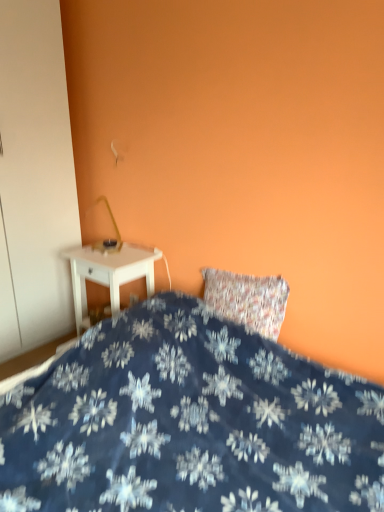
This screenshot has height=512, width=384. What do you see at coordinates (35, 178) in the screenshot?
I see `white matte armoire at left` at bounding box center [35, 178].

This screenshot has width=384, height=512. What do you see at coordinates (189, 423) in the screenshot?
I see `blue fabric bed at lower center` at bounding box center [189, 423].

This screenshot has height=512, width=384. I want to click on white matte armoire at left, so click(35, 178).

Considering the relative sizes of blue fabric bed at lower center and white plastic electric outlet at lower center in the image provided, is blue fabric bed at lower center shorter than white plastic electric outlet at lower center?

No.

From the picture: Is blue fabric bed at lower center not within white plastic electric outlet at lower center?

blue fabric bed at lower center lies outside white plastic electric outlet at lower center's area.

From the picture: Is there a large distance between blue fabric bed at lower center and white plastic electric outlet at lower center?

Yes, blue fabric bed at lower center and white plastic electric outlet at lower center are located far from each other.

How many degrees apart are the facing directions of blue fabric bed at lower center and white plastic electric outlet at lower center?

0.528 degrees.

Is white plastic electric outlet at lower center next to blue fabric bed at lower center?

No, white plastic electric outlet at lower center is not making contact with blue fabric bed at lower center.

Based on the photo, from the image's perspective, is white plastic electric outlet at lower center positioned above or below blue fabric bed at lower center?

Based on their image positions, white plastic electric outlet at lower center is located above blue fabric bed at lower center.

Which object is closer to the camera taking this photo, white plastic electric outlet at lower center or blue fabric bed at lower center?

blue fabric bed at lower center.

Is white plastic electric outlet at lower center smaller than blue fabric bed at lower center?

Yes.

Is white glossy nightstand at left thinner than white plastic electric outlet at lower center?

No, white glossy nightstand at left is not thinner than white plastic electric outlet at lower center.

Considering the positions of objects white glossy nightstand at left and white plastic electric outlet at lower center in the image provided, who is more to the right, white glossy nightstand at left or white plastic electric outlet at lower center?

From the viewer's perspective, white plastic electric outlet at lower center appears more on the right side.

How much distance is there between white glossy nightstand at left and white plastic electric outlet at lower center?

white glossy nightstand at left is 11.19 inches from white plastic electric outlet at lower center.

Is white glossy nightstand at left with white plastic electric outlet at lower center?

There is a gap between white glossy nightstand at left and white plastic electric outlet at lower center.

Does white matte armoire at left have a greater width compared to white plastic electric outlet at lower center?

Yes, white matte armoire at left is wider than white plastic electric outlet at lower center.

Considering the relative positions of white matte armoire at left and white plastic electric outlet at lower center in the image provided, is white matte armoire at left behind white plastic electric outlet at lower center?

No, white matte armoire at left is closer to the viewer.

Does point (15, 94) appear closer or farther from the camera than point (129, 298)?

Point (15, 94).

Is white matte armoire at left positioned beyond the bounds of white plastic electric outlet at lower center?

white matte armoire at left is positioned outside white plastic electric outlet at lower center.

Find the location of a particular element. The image size is (384, 512). nightstand behind the blue fabric bed at lower center is located at coordinates (109, 270).

Which is more to the right, white glossy nightstand at left or blue fabric bed at lower center?

blue fabric bed at lower center is more to the right.

Between white glossy nightstand at left and blue fabric bed at lower center, which one has less height?

white glossy nightstand at left.

Considering the relative positions of white glossy nightstand at left and blue fabric bed at lower center in the image provided, is white glossy nightstand at left behind blue fabric bed at lower center?

That is True.

From a real-world perspective, between white plastic electric outlet at lower center and white matte armoire at left, who is vertically lower?

white plastic electric outlet at lower center.

From the image's perspective, which object appears higher, white plastic electric outlet at lower center or white matte armoire at left?

From the image's view, white matte armoire at left is above.

Is white plastic electric outlet at lower center next to white matte armoire at left?

No.

From the image's perspective, who appears lower, white glossy nightstand at left or white matte armoire at left?

white glossy nightstand at left appears lower in the image.

Considering the relative positions of white glossy nightstand at left and white matte armoire at left in the image provided, is white glossy nightstand at left to the left or to the right of white matte armoire at left?

In the image, white glossy nightstand at left appears on the right side of white matte armoire at left.

This screenshot has height=512, width=384. Find the location of `nightstand located below the white matte armoire at left (from the image's perspective)`. nightstand located below the white matte armoire at left (from the image's perspective) is located at coordinates (109, 270).

The image size is (384, 512). I want to click on bed that appears on the right of white plastic electric outlet at lower center, so click(189, 423).

Find the location of a particular element. The image size is (384, 512). electric outlet located above the blue fabric bed at lower center (from the image's perspective) is located at coordinates (133, 298).

When comparing their distances from white plastic electric outlet at lower center, does white glossy nightstand at left or white matte armoire at left seem further?

The object further to white plastic electric outlet at lower center is white matte armoire at left.

When comparing their distances from white glossy nightstand at left, does white plastic electric outlet at lower center or blue fabric bed at lower center seem closer?

Based on the image, white plastic electric outlet at lower center appears to be nearer to white glossy nightstand at left.

Which object lies further to the anchor point white glossy nightstand at left, white plastic electric outlet at lower center or white matte armoire at left?

Among the two, white matte armoire at left is located further to white glossy nightstand at left.

Estimate the real-world distances between objects in this image. Which object is further from white matte armoire at left, blue fabric bed at lower center or white glossy nightstand at left?

blue fabric bed at lower center is positioned further to the anchor white matte armoire at left.

Which object lies nearer to the anchor point white plastic electric outlet at lower center, white glossy nightstand at left or blue fabric bed at lower center?

white glossy nightstand at left.

Estimate the real-world distances between objects in this image. Which object is closer to white glossy nightstand at left, white matte armoire at left or white plastic electric outlet at lower center?

The object closer to white glossy nightstand at left is white plastic electric outlet at lower center.

Looking at the image, which one is located further to blue fabric bed at lower center, white matte armoire at left or white plastic electric outlet at lower center?

The object further to blue fabric bed at lower center is white matte armoire at left.

Looking at the image, which one is located closer to white plastic electric outlet at lower center, white matte armoire at left or blue fabric bed at lower center?

Among the two, white matte armoire at left is located nearer to white plastic electric outlet at lower center.

I want to click on nightstand between white matte armoire at left and white plastic electric outlet at lower center vertically, so click(109, 270).

In order to click on armoire positioned between blue fabric bed at lower center and white plastic electric outlet at lower center from near to far in this screenshot , I will do `click(35, 178)`.

The image size is (384, 512). Identify the location of armoire positioned between blue fabric bed at lower center and white glossy nightstand at left from near to far. (35, 178).

Where is `nightstand between blue fabric bed at lower center and white plastic electric outlet at lower center from front to back`? nightstand between blue fabric bed at lower center and white plastic electric outlet at lower center from front to back is located at coordinates (109, 270).